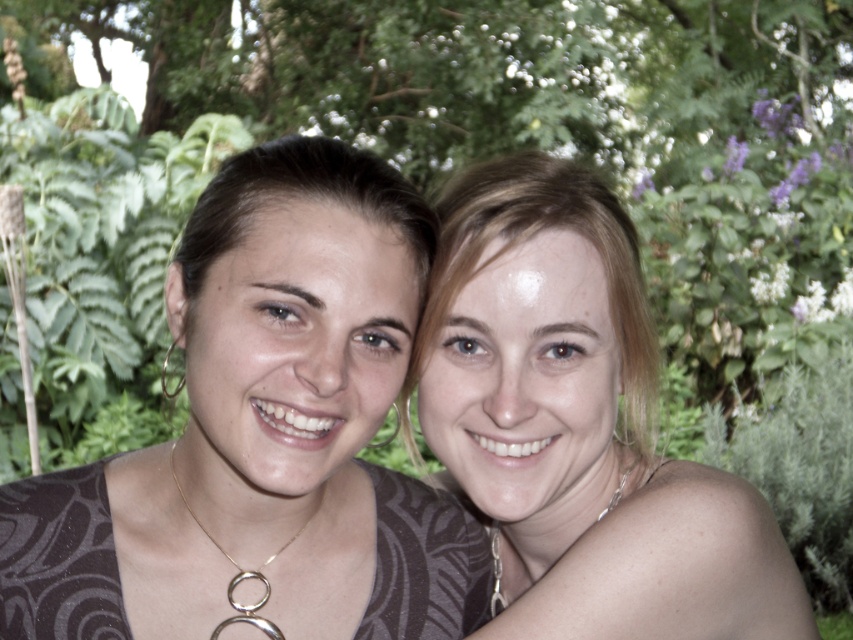
You are standing in front of the image and want to determine which of the two points, point [662,486] or point [271,634], is closer to you. Based on the scene, can you tell which one is nearer?

Point [662,486] is further to the viewer than point [271,634]. Therefore, point [271,634] is closer to you.